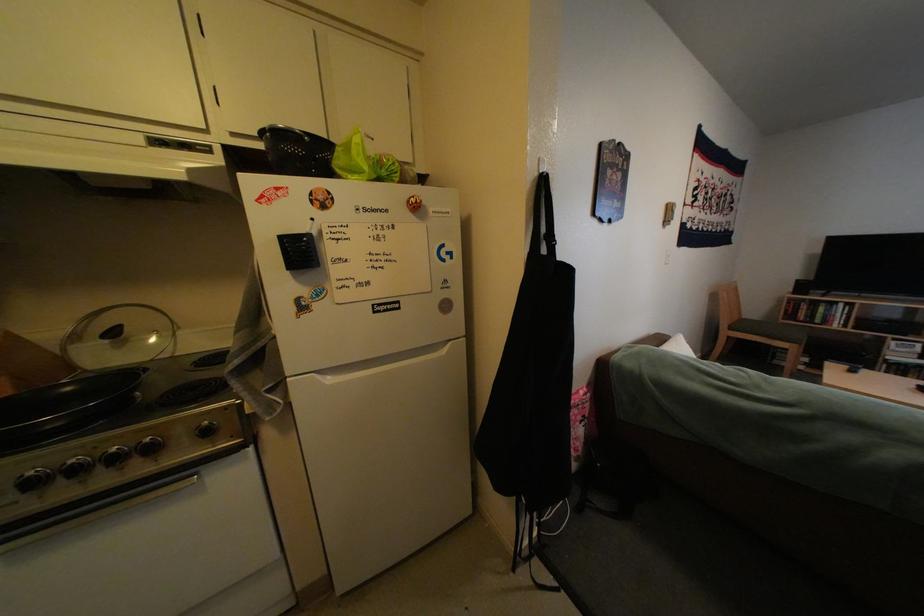
Describe the element at coordinates (118, 338) in the screenshot. Image resolution: width=924 pixels, height=616 pixels. I see `the pot lid handle` at that location.